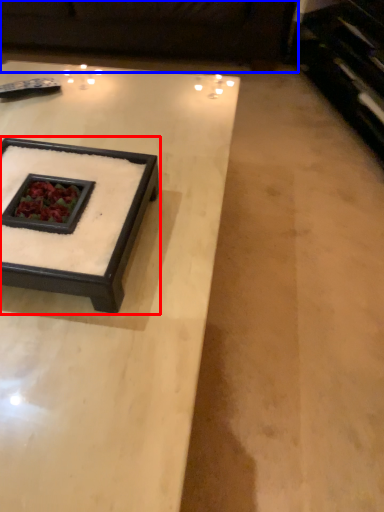
Question: Among these objects, which one is nearest to the camera, coffee table (highlighted by a red box) or couch (highlighted by a blue box)?

Choices:
 (A) coffee table
 (B) couch

Answer: (A)